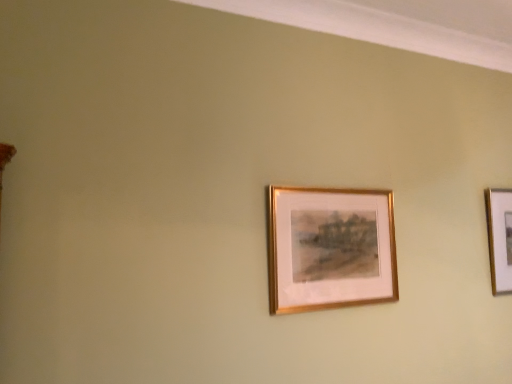
Question: From their relative heights in the image, would you say gold metallic picture frame at center, the second picture frame in the right-to-left sequence, is taller or shorter than gold metallic picture frame at right, the second picture frame positioned from the left?

Choices:
 (A) tall
 (B) short

Answer: (B)

Question: From the image's perspective, is gold metallic picture frame at center, the second picture frame in the right-to-left sequence, above or below gold metallic picture frame at right, which appears as the first picture frame when viewed from the back?

Choices:
 (A) above
 (B) below

Answer: (A)

Question: From a real-world perspective, is gold metallic picture frame at center, which appears as the second picture frame when viewed from the back, positioned above or below gold metallic picture frame at right, which appears as the first picture frame when viewed from the back?

Choices:
 (A) below
 (B) above

Answer: (A)

Question: Considering the positions of gold metallic picture frame at right, which is the second picture frame in front-to-back order, and gold metallic picture frame at center, placed as the first picture frame when sorted from left to right, in the image, is gold metallic picture frame at right, which is the second picture frame in front-to-back order, bigger or smaller than gold metallic picture frame at center, placed as the first picture frame when sorted from left to right,?

Choices:
 (A) small
 (B) big

Answer: (A)

Question: Is gold metallic picture frame at right, the second picture frame positioned from the left, situated inside gold metallic picture frame at center, the second picture frame in the right-to-left sequence, or outside?

Choices:
 (A) inside
 (B) outside

Answer: (B)

Question: Based on their positions, is gold metallic picture frame at right, which appears as the first picture frame when viewed from the back, located to the left or right of gold metallic picture frame at center, placed as the first picture frame when sorted from left to right?

Choices:
 (A) left
 (B) right

Answer: (B)

Question: In the image, is gold metallic picture frame at right, which is the second picture frame in front-to-back order, positioned in front of or behind gold metallic picture frame at center, placed as the first picture frame when sorted from left to right?

Choices:
 (A) behind
 (B) front

Answer: (A)